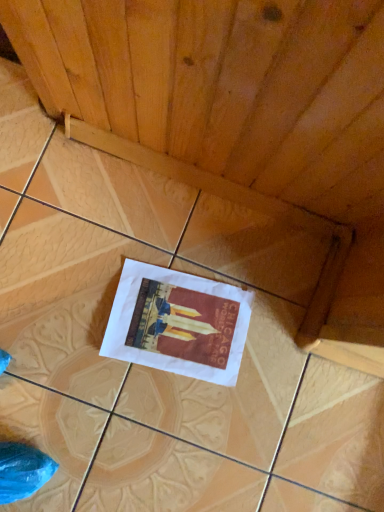
Question: Is wooden at center to the left or to the right of white paper poster at center in the image?

Choices:
 (A) right
 (B) left

Answer: (B)

Question: From a real-world perspective, is wooden at center positioned above or below white paper poster at center?

Choices:
 (A) above
 (B) below

Answer: (B)

Question: From the image's perspective, is wooden at center positioned above or below white paper poster at center?

Choices:
 (A) below
 (B) above

Answer: (B)

Question: Relative to wooden at center, is white paper poster at center in front or behind?

Choices:
 (A) front
 (B) behind

Answer: (B)

Question: From the image's perspective, is white paper poster at center positioned above or below wooden at center?

Choices:
 (A) above
 (B) below

Answer: (B)

Question: Does point (144, 348) appear closer or farther from the camera than point (264, 113)?

Choices:
 (A) farther
 (B) closer

Answer: (A)

Question: Is white paper poster at center wider or thinner than wooden at center?

Choices:
 (A) wide
 (B) thin

Answer: (B)